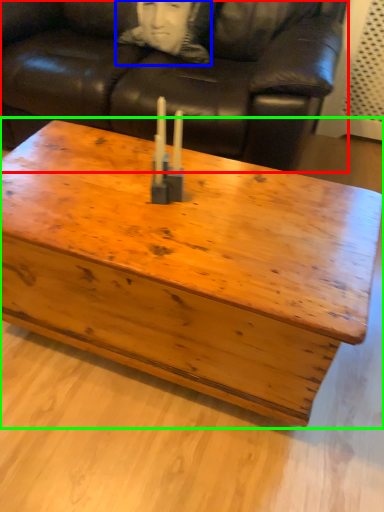
Question: Estimate the real-world distances between objects in this image. Which object is farther from studio couch (highlighted by a red box), person (highlighted by a blue box) or coffee table (highlighted by a green box)?

Choices:
 (A) person
 (B) coffee table

Answer: (B)